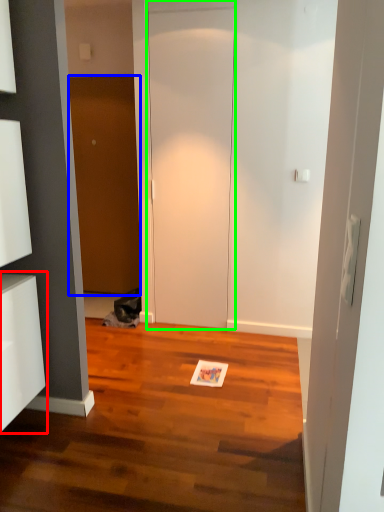
Question: Considering the real-world distances, which object is farthest from cabinetry (highlighted by a red box)? door (highlighted by a blue box) or door (highlighted by a green box)?

Choices:
 (A) door
 (B) door

Answer: (A)